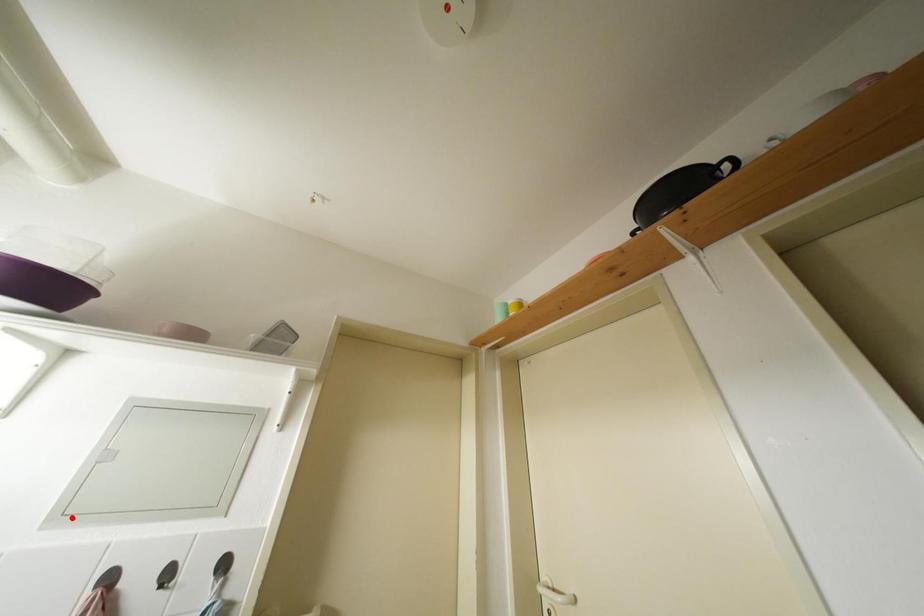
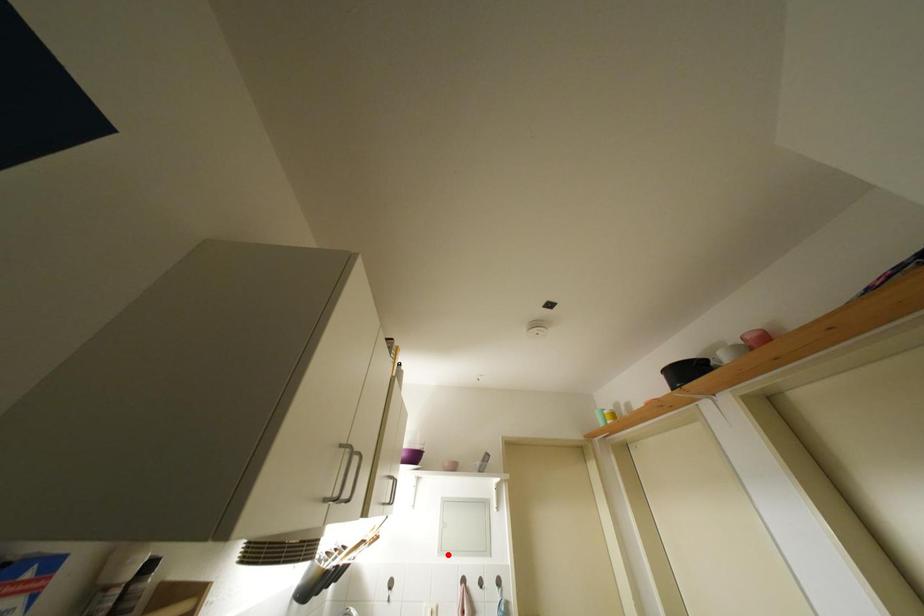
I am providing you with two images of the same scene from different viewpoints. A red point is marked on the first image and another point is marked on the second image. Does the point marked in image1 correspond to the same location as the one in image2?

Yes